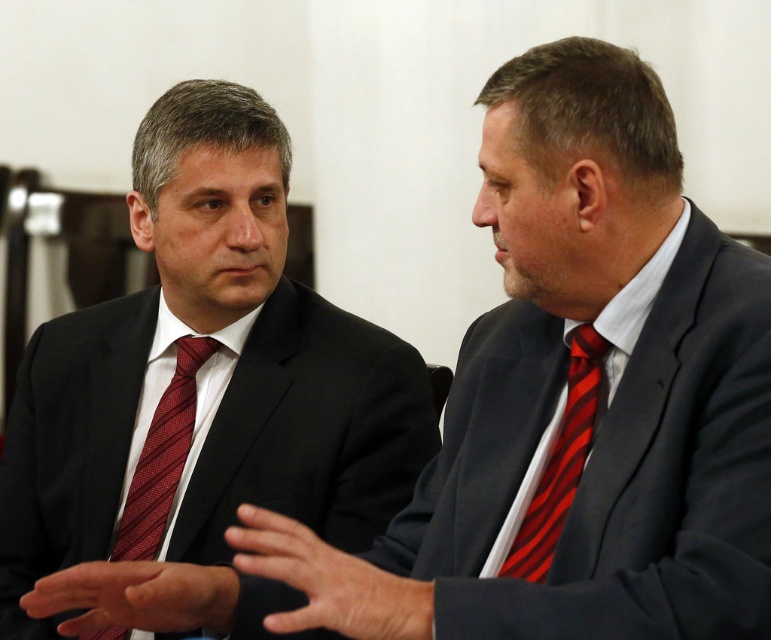
You are a photographer standing in front of two formally dressed men. You want to take a closeup photo of the red striped tie at left without getting too close. What is the minimum distance you should maintain to ensure the camera can capture the tie clearly?

The minimum distance you should maintain is 1.53 meters because the red striped tie at left and viewer are 1.53 meters apart.

You are standing in an office and see a point marked at coordinates point (603, 577). If you want to place a 1.5 meter long banner between you and that point, will it fit?

The distance from the viewer to point (603, 577) is 1.09 meters. Since the banner is 1.5 meters long, it will not fit as the available space is shorter than the banner.